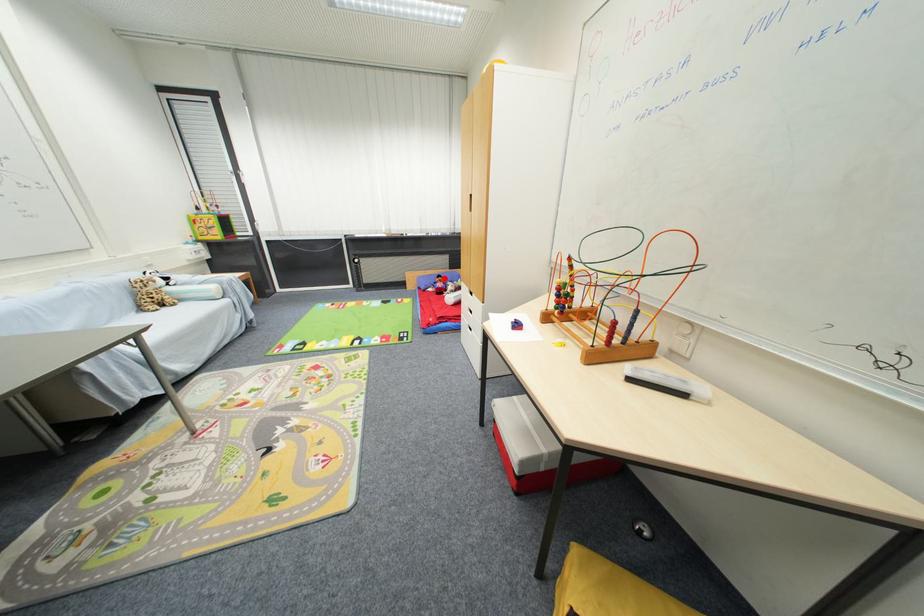
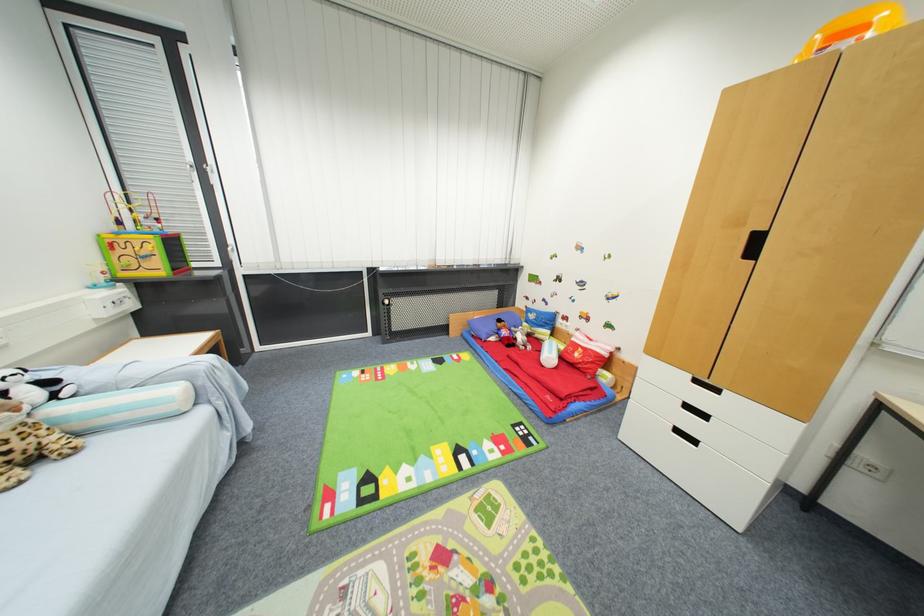
Question: I am providing you with two images of the same scene from different viewpoints. Image1 has a red point marked. In image2, the corresponding 3D location appears at what relative position? Reply with the corresponding letter.

Choices:
 (A) Closer
 (B) Farther

Answer: (B)